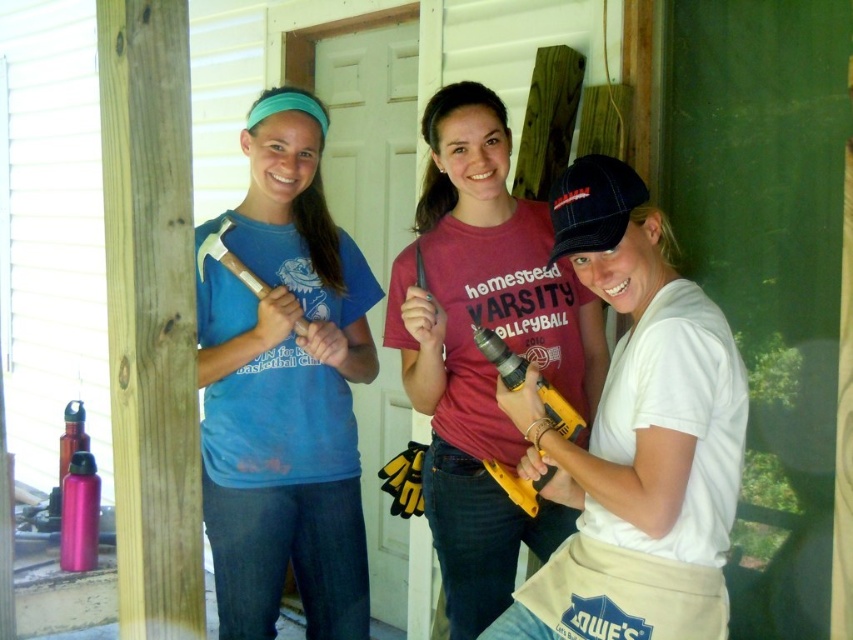
You are standing in front of the construction site and want to reach both the point at coordinates [291,298] and the point at coordinates [607,173]. Which point will you reach first if you move straight towards them?

You will reach point [291,298] first because it is closer to you than point [607,173], which is further away.

You are a contractor working on a construction site and need to place a 12 inch ruler between the black fabric baseball cap at center and the yellow plastic drill at center. Will the ruler fit between them?

The distance between the black fabric baseball cap at center and the yellow plastic drill at center is 11.69 inches. Since the ruler is 12 inches long, it will not fit between them as the space is slightly smaller.